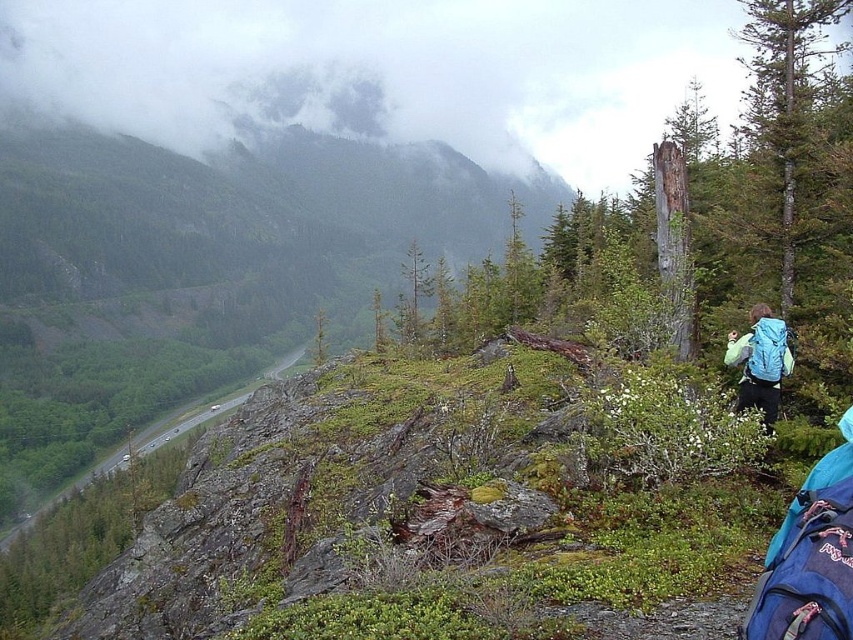
From the picture: You are a hiker who has just reached the rocky outcrop. You see the blue backpack at right and the green grassy trail at lower left. Which object is higher in elevation?

The blue backpack at right is above the green grassy trail at lower left, so it is higher in elevation.

You are a hiker who has just reached the top of a mountain and wants to place your blue backpack at right on the ground. You also notice the green grassy trail at lower left. Considering the size of your backpack, will it fit comfortably on the trail without blocking the path?

The blue backpack at right is smaller in size compared to the green grassy trail at lower left, so it should fit comfortably on the trail without blocking the path.